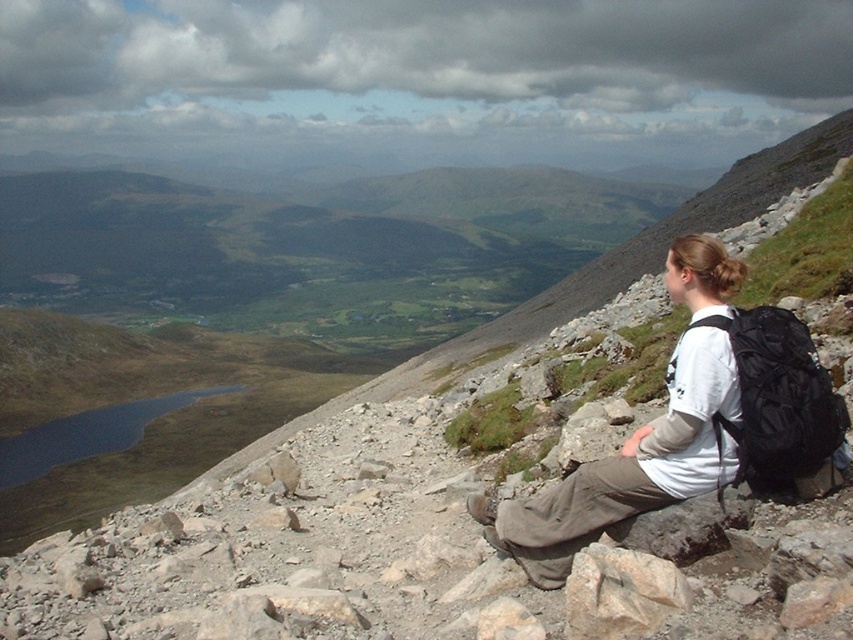
Is black fabric backpack at right closer to camera compared to rough textured rock at lower right?

No, it is behind rough textured rock at lower right.

Does black fabric backpack at right appear under rough textured rock at lower right?

Incorrect, black fabric backpack at right is not positioned below rough textured rock at lower right.

Measure the distance between black fabric backpack at right and camera.

The distance of black fabric backpack at right from camera is 20.67 feet.

You are a GUI agent. You are given a task and a screenshot of the screen. Output one action in this format:
    pyautogui.click(x=<x>, y=<y>)
    Task: Click on the black fabric backpack at right
    The width and height of the screenshot is (853, 640).
    Given the screenshot: What is the action you would take?
    pyautogui.click(x=778, y=401)

Looking at this image, which is more to the left, white cotton shirt at center or black fabric backpack at right?

white cotton shirt at center is more to the left.

Which is more to the right, white cotton shirt at center or black fabric backpack at right?

black fabric backpack at right

Which is in front, point (701, 276) or point (738, 336)?

Positioned in front is point (738, 336).

Identify the location of white cotton shirt at center. (628, 467).

Describe the element at coordinates (628, 467) in the screenshot. I see `white cotton shirt at center` at that location.

Is point (668, 289) in front of point (606, 621)?

That is False.

At what (x,y) coordinates should I click in order to perform the action: click on white cotton shirt at center. Please return your answer as a coordinate pair (x, y). The height and width of the screenshot is (640, 853). Looking at the image, I should click on (628, 467).